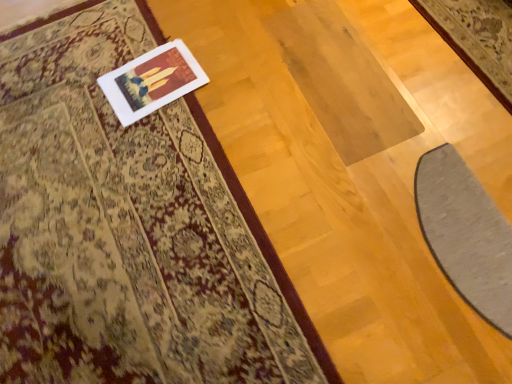
Question: Is the position of silky beige rug at upper left more distant than that of white matte picture frame at upper left?

Choices:
 (A) yes
 (B) no

Answer: (B)

Question: Can you confirm if silky beige rug at upper left is smaller than white matte picture frame at upper left?

Choices:
 (A) yes
 (B) no

Answer: (B)

Question: Is silky beige rug at upper left in contact with white matte picture frame at upper left?

Choices:
 (A) yes
 (B) no

Answer: (B)

Question: From the image's perspective, is silky beige rug at upper left located beneath white matte picture frame at upper left?

Choices:
 (A) no
 (B) yes

Answer: (B)

Question: Is silky beige rug at upper left to the left of white matte picture frame at upper left from the viewer's perspective?

Choices:
 (A) no
 (B) yes

Answer: (B)

Question: Is silky beige rug at upper left to the right of white matte picture frame at upper left from the viewer's perspective?

Choices:
 (A) no
 (B) yes

Answer: (A)

Question: Does white matte picture frame at upper left have a larger size compared to silky beige rug at upper left?

Choices:
 (A) no
 (B) yes

Answer: (A)

Question: Is white matte picture frame at upper left beside silky beige rug at upper left?

Choices:
 (A) no
 (B) yes

Answer: (A)

Question: Is white matte picture frame at upper left facing away from silky beige rug at upper left?

Choices:
 (A) yes
 (B) no

Answer: (A)

Question: From a real-world perspective, is white matte picture frame at upper left located beneath silky beige rug at upper left?

Choices:
 (A) yes
 (B) no

Answer: (A)

Question: From a real-world perspective, does white matte picture frame at upper left stand above silky beige rug at upper left?

Choices:
 (A) yes
 (B) no

Answer: (B)

Question: From the image's perspective, is white matte picture frame at upper left below silky beige rug at upper left?

Choices:
 (A) no
 (B) yes

Answer: (A)

Question: Is white matte picture frame at upper left in contact with gray soft mat at lower right?

Choices:
 (A) no
 (B) yes

Answer: (A)